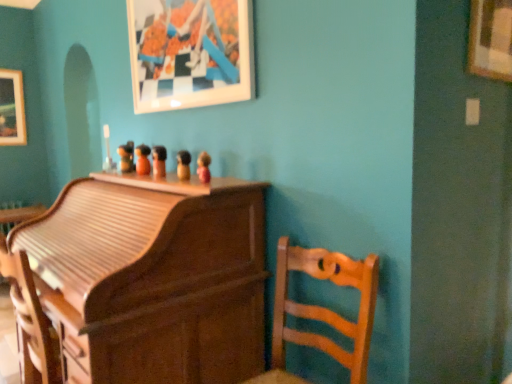
Question: Are wooden toy at center, the 4th toy from the front, and wooden picture frame at upper right, the 3th picture frame positioned from the left, located far from each other?

Choices:
 (A) yes
 (B) no

Answer: (A)

Question: Can you confirm if wooden toy at center, arranged as the second toy when viewed from the back, is bigger than wooden picture frame at upper right, the third picture frame in the back-to-front sequence?

Choices:
 (A) yes
 (B) no

Answer: (B)

Question: From a real-world perspective, is wooden toy at center, the 4th toy from the front, beneath wooden picture frame at upper right, the third picture frame in the back-to-front sequence?

Choices:
 (A) yes
 (B) no

Answer: (A)

Question: From the image's perspective, is wooden toy at center, the 4th toy from the front, under wooden picture frame at upper right, the 3th picture frame positioned from the left?

Choices:
 (A) yes
 (B) no

Answer: (A)

Question: Is wooden toy at center, arranged as the second toy when viewed from the back, further to the viewer compared to wooden picture frame at upper right, placed as the 1th picture frame when sorted from front to back?

Choices:
 (A) no
 (B) yes

Answer: (B)

Question: Can we say wooden toy at center, arranged as the second toy when viewed from the back, lies outside wooden picture frame at upper right, the 3th picture frame positioned from the left?

Choices:
 (A) yes
 (B) no

Answer: (A)

Question: Does wooden figurine at center, placed as the fourth toy when sorted from back to front, come in front of matte white picture frame at upper center, the second picture frame viewed from the right?

Choices:
 (A) no
 (B) yes

Answer: (A)

Question: Could you tell me if wooden figurine at center, the 2th toy from the front, is turned towards matte white picture frame at upper center, the second picture frame positioned from the front?

Choices:
 (A) yes
 (B) no

Answer: (B)

Question: Considering the relative positions of wooden figurine at center, which is counted as the fourth toy, starting from the left, and matte white picture frame at upper center, the second picture frame viewed from the back, in the image provided, is wooden figurine at center, which is counted as the fourth toy, starting from the left, to the left of matte white picture frame at upper center, the second picture frame viewed from the back, from the viewer's perspective?

Choices:
 (A) no
 (B) yes

Answer: (A)

Question: Could matte white picture frame at upper center, the second picture frame positioned from the front, be considered to be inside wooden figurine at center, the 2th toy from the front?

Choices:
 (A) yes
 (B) no

Answer: (B)

Question: Does wooden figurine at center, placed as the fourth toy when sorted from back to front, lie behind matte white picture frame at upper center, the second picture frame viewed from the back?

Choices:
 (A) no
 (B) yes

Answer: (B)

Question: Can you confirm if wooden figurine at center, the 2th toy from the front, is thinner than matte white picture frame at upper center, the second picture frame viewed from the back?

Choices:
 (A) no
 (B) yes

Answer: (A)

Question: Is matte white picture frame at upper center, the second picture frame viewed from the back, at the left side of wooden figurine at center, the first toy when ordered from back to front?

Choices:
 (A) yes
 (B) no

Answer: (B)